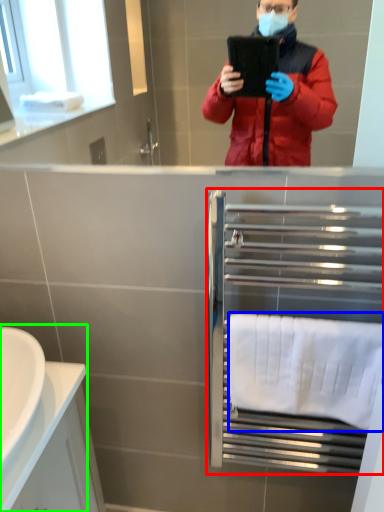
Question: Which object is positioned closest to balustrade (highlighted by a red box)? Select from towel/napkin (highlighted by a blue box) and sink (highlighted by a green box).

Choices:
 (A) towel/napkin
 (B) sink

Answer: (A)